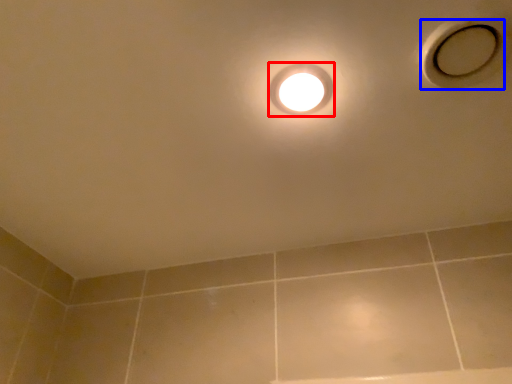
Question: Which of the following is the closest to the observer, droplight (highlighted by a red box) or hole (highlighted by a blue box)?

Choices:
 (A) droplight
 (B) hole

Answer: (B)